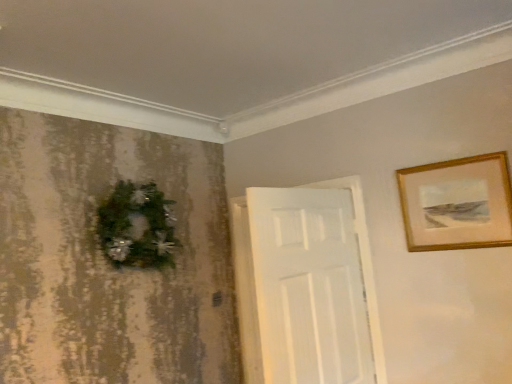
Question: Is green matte wreath at left in front of or behind gold wooden picture frame at upper right in the image?

Choices:
 (A) behind
 (B) front

Answer: (A)

Question: Is green matte wreath at left bigger or smaller than gold wooden picture frame at upper right?

Choices:
 (A) big
 (B) small

Answer: (A)

Question: Considering the positions of green matte wreath at left and gold wooden picture frame at upper right in the image, is green matte wreath at left taller or shorter than gold wooden picture frame at upper right?

Choices:
 (A) tall
 (B) short

Answer: (A)

Question: In terms of size, does gold wooden picture frame at upper right appear bigger or smaller than green matte wreath at left?

Choices:
 (A) big
 (B) small

Answer: (B)

Question: Considering their positions, is gold wooden picture frame at upper right located in front of or behind green matte wreath at left?

Choices:
 (A) behind
 (B) front

Answer: (B)

Question: Is gold wooden picture frame at upper right inside the boundaries of green matte wreath at left, or outside?

Choices:
 (A) inside
 (B) outside

Answer: (B)

Question: From a real-world perspective, relative to green matte wreath at left, is gold wooden picture frame at upper right vertically above or below?

Choices:
 (A) above
 (B) below

Answer: (B)